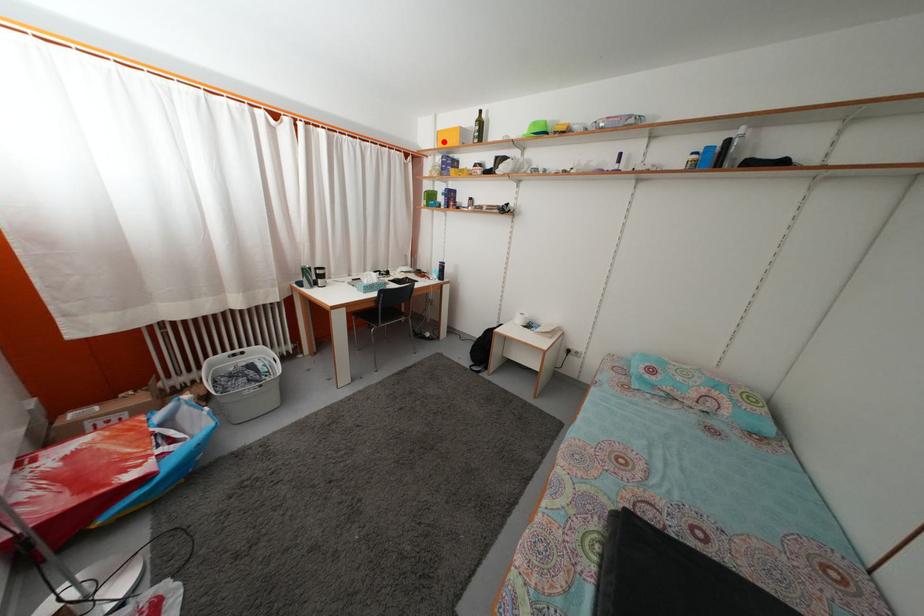
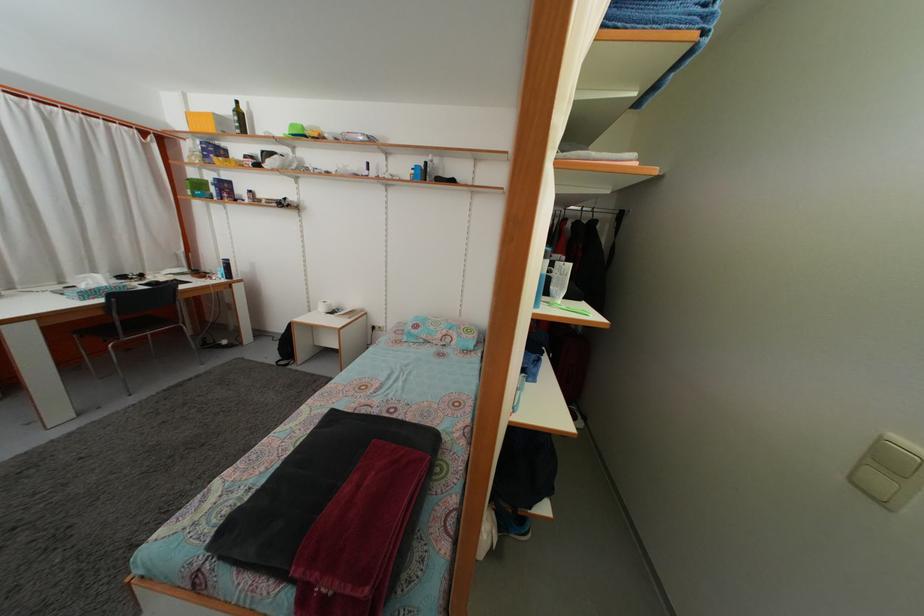
Question: I am providing you with two images of the same scene from different viewpoints. A red point is shown in image1. For the corresponding object point in image2, is it positioned nearer or farther from the camera?

Choices:
 (A) Nearer
 (B) Farther

Answer: (B)